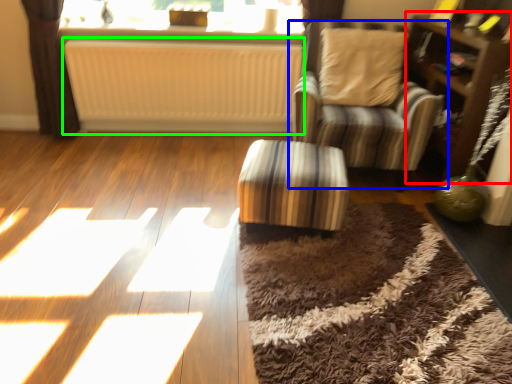
Question: Which is farther away from dresser (highlighted by a red box)? chair (highlighted by a blue box) or radiator (highlighted by a green box)?

Choices:
 (A) chair
 (B) radiator

Answer: (B)